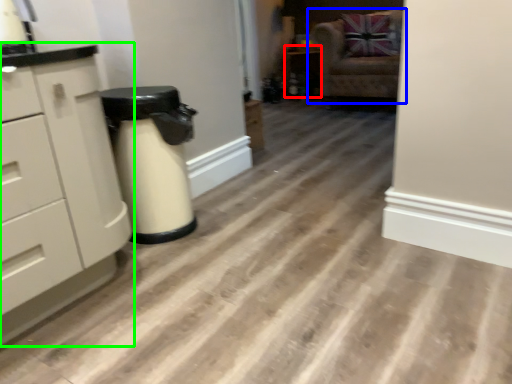
Question: Which is nearer to the cabinetry (highlighted by a red box)? chair (highlighted by a blue box) or chest of drawers (highlighted by a green box).

Choices:
 (A) chair
 (B) chest of drawers

Answer: (A)